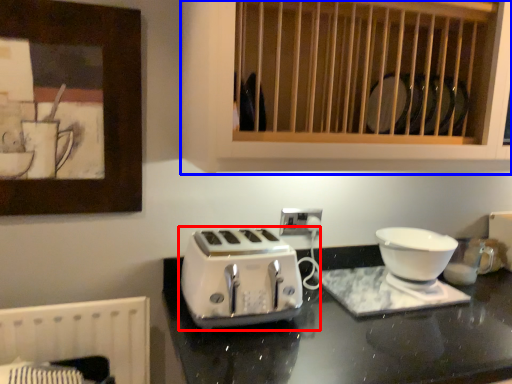
Question: Which object appears farthest to the camera in this image, toaster (highlighted by a red box) or cabinetry (highlighted by a blue box)?

Choices:
 (A) toaster
 (B) cabinetry

Answer: (A)